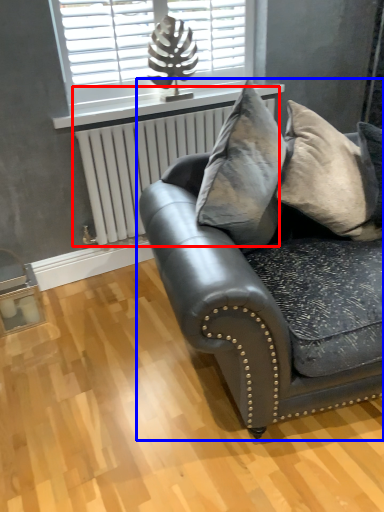
Question: Which object is closer to the camera taking this photo, radiator (highlighted by a red box) or studio couch (highlighted by a blue box)?

Choices:
 (A) radiator
 (B) studio couch

Answer: (B)